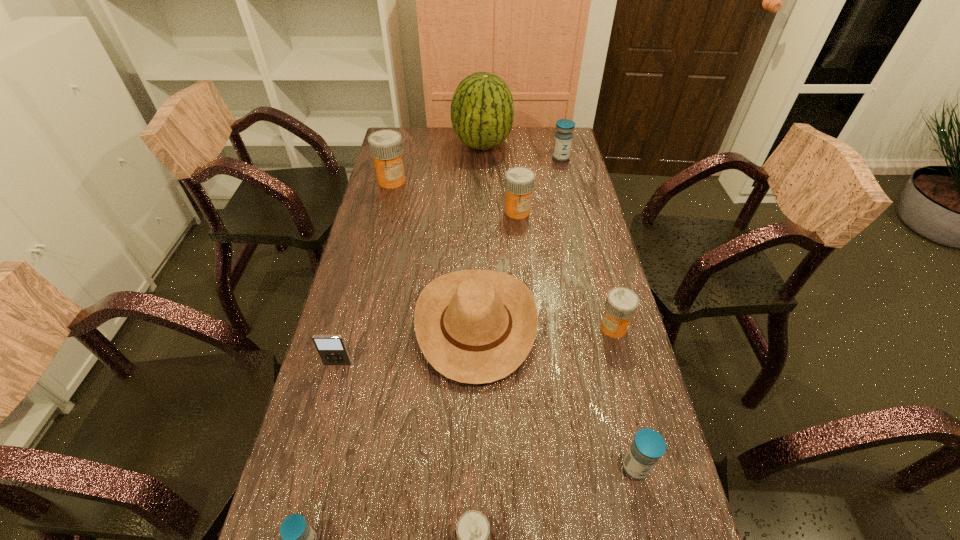
At what (x,y) coordinates should I click in order to perform the action: click on the tallest object. Please return your answer as a coordinate pair (x, y). This screenshot has height=540, width=960. Looking at the image, I should click on (482, 110).

Where is `watermelon`? This screenshot has width=960, height=540. watermelon is located at coordinates (482, 110).

Where is `the leftmost orange medicine`? The height and width of the screenshot is (540, 960). the leftmost orange medicine is located at coordinates (386, 147).

In order to click on the farthest orange medicine in this screenshot , I will do `click(386, 147)`.

The image size is (960, 540). In order to click on the biggest blue medicine in this screenshot , I will do `click(563, 138)`.

Where is `the farthest blue medicine`? This screenshot has height=540, width=960. the farthest blue medicine is located at coordinates (563, 138).

Where is `the fourth medicine from right to left`? The width and height of the screenshot is (960, 540). the fourth medicine from right to left is located at coordinates tap(519, 181).

At what (x,y) coordinates should I click in order to perform the action: click on the fourth farthest object. Please return your answer as a coordinate pair (x, y). Image resolution: width=960 pixels, height=540 pixels. Looking at the image, I should click on (519, 181).

Locate an element on the screen. This screenshot has width=960, height=540. cowboy hat is located at coordinates (476, 326).

The width and height of the screenshot is (960, 540). What are the coordinates of `the third farthest orange medicine` in the screenshot? It's located at (621, 304).